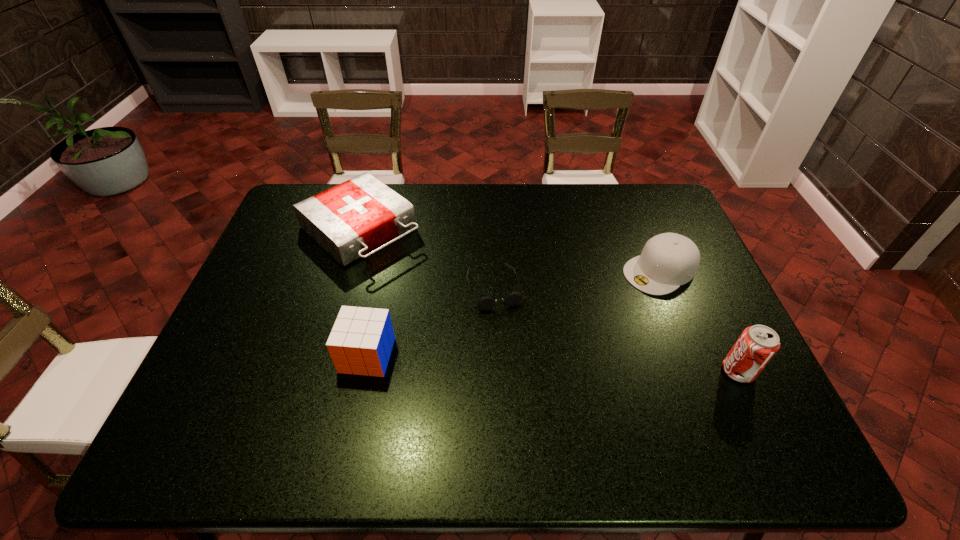
You are a GUI agent. You are given a task and a screenshot of the screen. Output one action in this format:
    pyautogui.click(x=<x>, y=<y>)
    Task: Click on the vacant space that satisfies the following two spatial constraints: 1. on the front side of the first-aid kit; 2. on the left side of the tallest object
    The width and height of the screenshot is (960, 540).
    Given the screenshot: What is the action you would take?
    pyautogui.click(x=320, y=371)

Identify the location of vacant space that satisfies the following two spatial constraints: 1. on the back side of the third object from left to right; 2. on the right side of the cube. The image size is (960, 540). (381, 288).

You are a GUI agent. You are given a task and a screenshot of the screen. Output one action in this format:
    pyautogui.click(x=<x>, y=<y>)
    Task: Click on the vacant region that satisfies the following two spatial constraints: 1. on the front side of the tallest object; 2. on the right side of the first-aid kit
    The image size is (960, 540).
    Given the screenshot: What is the action you would take?
    pyautogui.click(x=320, y=371)